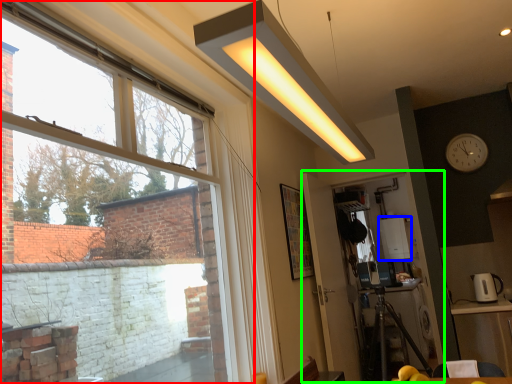
Question: Which object is the farthest from window (highlighted by a red box)? Choose among these: appliance (highlighted by a blue box) or screen door (highlighted by a green box).

Choices:
 (A) appliance
 (B) screen door

Answer: (A)